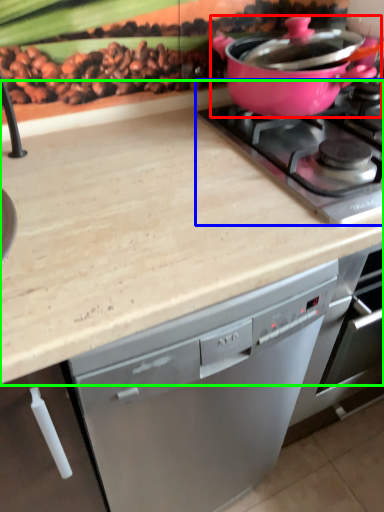
Question: Which is farther away from kitchen appliance (highlighted by a red box)? gas stove (highlighted by a blue box) or countertop (highlighted by a green box)?

Choices:
 (A) gas stove
 (B) countertop

Answer: (B)